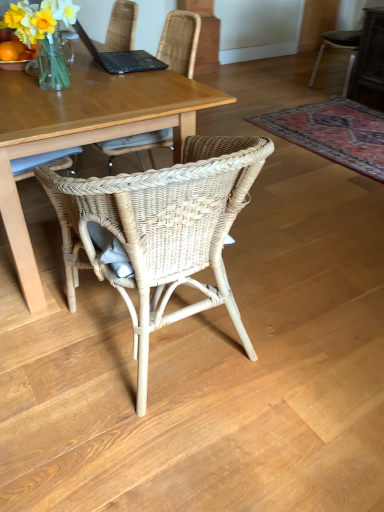
Find the location of a particular element. This screenshot has height=512, width=384. vacant area that is situated to the right of translucent glass vase at upper left is located at coordinates (120, 88).